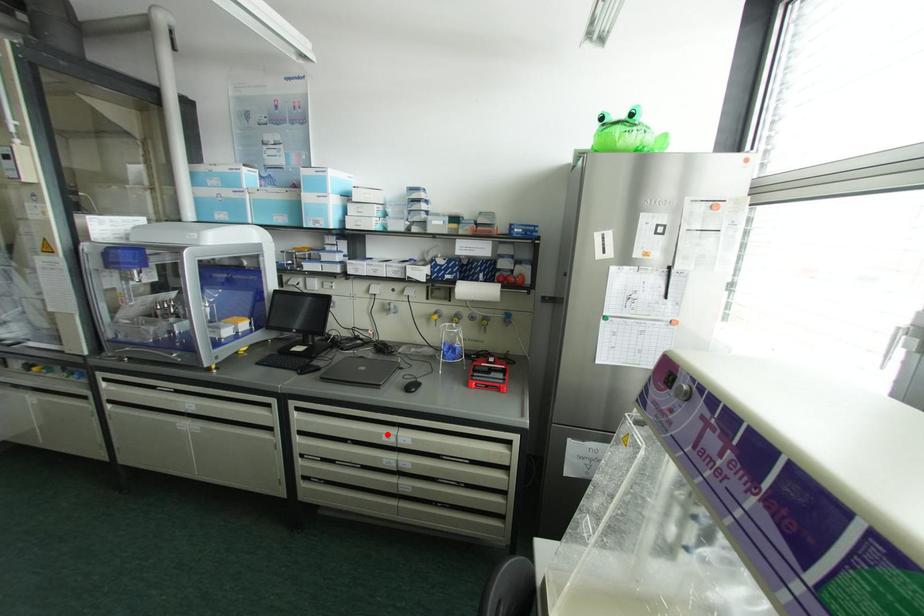
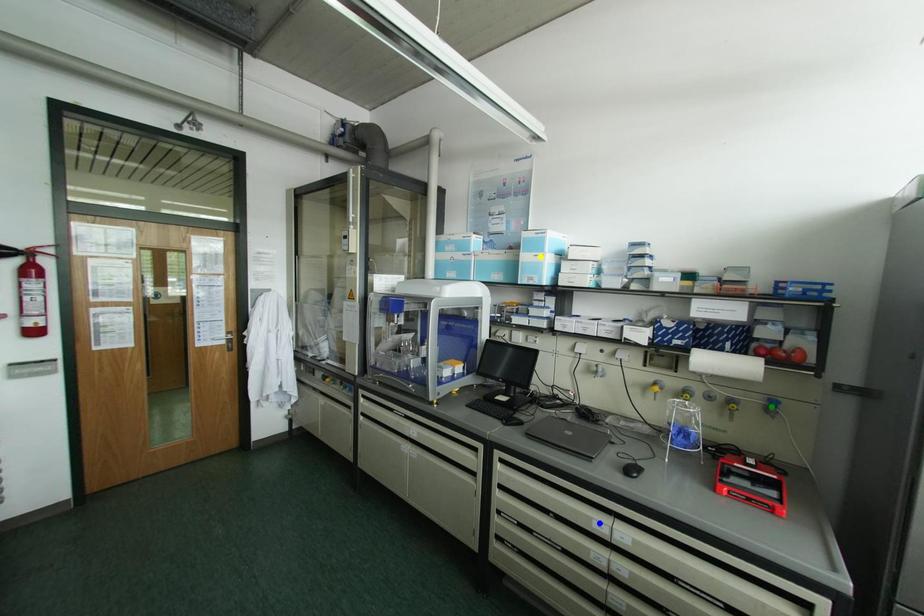
Question: I am providing you with two images of the same scene from different viewpoints. A red point is marked on the first image. You are given multiple points on the second image. Which mark in image 2 goes with the point in image 1?

Choices:
 (A) green point
 (B) blue point
 (C) yellow point

Answer: (B)